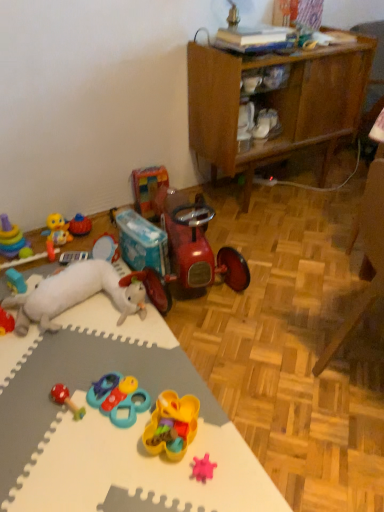
Question: Is teal plastic toy at center, the eighth toy viewed from the left, closer to the viewer compared to rubber duck at left, the 4th toy from the left?

Choices:
 (A) no
 (B) yes

Answer: (B)

Question: Is teal plastic toy at center, the eighth toy viewed from the left, shorter than rubber duck at left, positioned as the ninth toy in right-to-left order?

Choices:
 (A) yes
 (B) no

Answer: (A)

Question: Is teal plastic toy at center, the eighth toy viewed from the left, directly adjacent to rubber duck at left, the 4th toy from the left?

Choices:
 (A) yes
 (B) no

Answer: (B)

Question: Is teal plastic toy at center, the eighth toy viewed from the left, at the right side of rubber duck at left, positioned as the ninth toy in right-to-left order?

Choices:
 (A) no
 (B) yes

Answer: (B)

Question: Considering the relative sizes of teal plastic toy at center, the 5th toy viewed from the right, and rubber duck at left, positioned as the ninth toy in right-to-left order, in the image provided, is teal plastic toy at center, the 5th toy viewed from the right, bigger than rubber duck at left, positioned as the ninth toy in right-to-left order,?

Choices:
 (A) yes
 (B) no

Answer: (B)

Question: Based on their sizes in the image, would you say white foam mat at lower left is bigger or smaller than translucent yellow plastic toy at center, the second toy in the right-to-left sequence?

Choices:
 (A) big
 (B) small

Answer: (A)

Question: Considering the relative positions of white foam mat at lower left and translucent yellow plastic toy at center, the second toy in the right-to-left sequence, in the image provided, is white foam mat at lower left to the left or to the right of translucent yellow plastic toy at center, the second toy in the right-to-left sequence,?

Choices:
 (A) left
 (B) right

Answer: (A)

Question: Is white foam mat at lower left spatially inside translucent yellow plastic toy at center, marked as the 11th toy in a left-to-right arrangement, or outside of it?

Choices:
 (A) inside
 (B) outside

Answer: (B)

Question: From the image's perspective, is white foam mat at lower left above or below translucent yellow plastic toy at center, the second toy in the right-to-left sequence?

Choices:
 (A) below
 (B) above

Answer: (B)

Question: Relative to multicolored plastic rings at left, the first toy viewed from the left, is wooden cabinet at upper right in front or behind?

Choices:
 (A) front
 (B) behind

Answer: (A)

Question: Looking at their shapes, would you say wooden cabinet at upper right is wider or thinner than multicolored plastic rings at left, which ranks as the 12th toy in right-to-left order?

Choices:
 (A) thin
 (B) wide

Answer: (B)

Question: From the image's perspective, is wooden cabinet at upper right located above or below multicolored plastic rings at left, which ranks as the 12th toy in right-to-left order?

Choices:
 (A) above
 (B) below

Answer: (A)

Question: In the image, is wooden cabinet at upper right on the left side or the right side of multicolored plastic rings at left, the first toy viewed from the left?

Choices:
 (A) left
 (B) right

Answer: (B)

Question: Would you say teal plastic toy at center, the 5th toy viewed from the right, is inside or outside white matte shoe at center?

Choices:
 (A) outside
 (B) inside

Answer: (A)

Question: From the image's perspective, is teal plastic toy at center, the eighth toy viewed from the left, positioned above or below white matte shoe at center?

Choices:
 (A) below
 (B) above

Answer: (A)